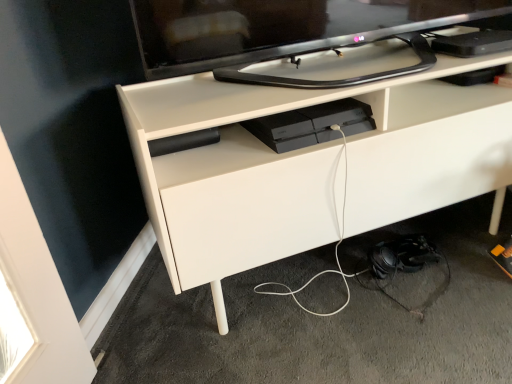
Identify the location of empty space that is ontop of white matte cable at lower center (from a real-world perspective). (354, 297).